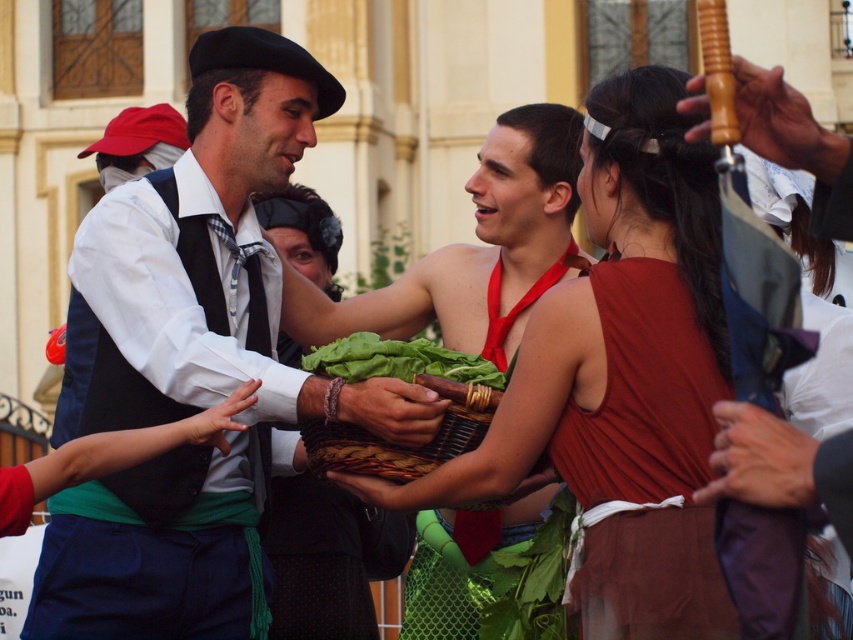
Is matte red dress at center smaller than woven brown basket at center?

No, matte red dress at center is not smaller than woven brown basket at center.

Who is more forward, (x=556, y=308) or (x=347, y=472)?

Point (x=556, y=308) is more forward.

Measure the distance between matte red dress at center and camera.

matte red dress at center is 40.45 meters away from camera.

I want to click on matte red dress at center, so click(x=622, y=376).

You are a GUI agent. You are given a task and a screenshot of the screen. Output one action in this format:
    pyautogui.click(x=<x>, y=<y>)
    Task: Click on the matte black vest at center
    
    Given the screenshot: What is the action you would take?
    pyautogui.click(x=196, y=365)

Does matte black vest at center have a greater height compared to matte red dress at center?

Yes.

Image resolution: width=853 pixels, height=640 pixels. I want to click on matte black vest at center, so click(196, 365).

I want to click on matte black vest at center, so click(x=196, y=365).

Who is more distant from viewer, (172, 314) or (413, 477)?

The point (172, 314) is more distant.

Is matte black vest at center below woven brown basket at center?

No, matte black vest at center is not below woven brown basket at center.

What do you see at coordinates (196, 365) in the screenshot? I see `matte black vest at center` at bounding box center [196, 365].

Locate an element on the screen. The image size is (853, 640). matte black vest at center is located at coordinates (196, 365).